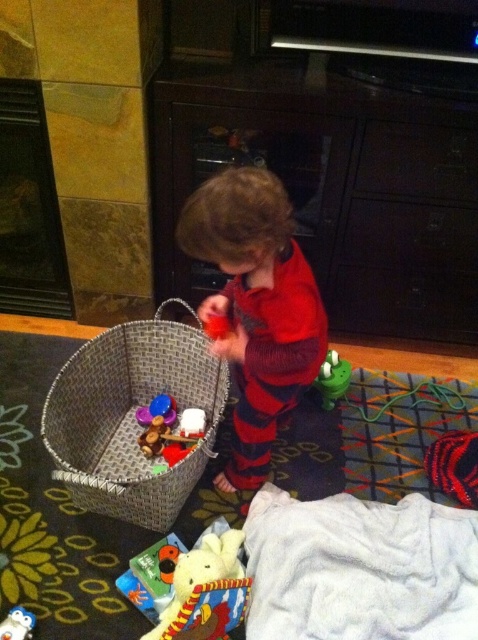
Is black matte drawer at center closer to camera compared to smooth plastic cup at center?

No.

Is point (444, 221) in front of point (142, 419)?

No, it is behind (142, 419).

Who is more forward, (x=445, y=205) or (x=148, y=406)?

Point (x=445, y=205) is in front.

Locate an element on the screen. This screenshot has height=640, width=478. black matte drawer at center is located at coordinates (411, 236).

Is woven brown basket at lower left positioned before green rubber toy at lower center?

Yes, woven brown basket at lower left is closer to the viewer.

From the picture: Does woven brown basket at lower left have a larger size compared to green rubber toy at lower center?

Yes, woven brown basket at lower left is bigger than green rubber toy at lower center.

Is point (195, 378) closer to viewer compared to point (325, 371)?

Yes, point (195, 378) is closer to viewer.

You are a GUI agent. You are given a task and a screenshot of the screen. Output one action in this format:
    pyautogui.click(x=<x>, y=<y>)
    Task: Click on the woven brown basket at lower left
    The height and width of the screenshot is (640, 478).
    Given the screenshot: What is the action you would take?
    pyautogui.click(x=130, y=417)

Is woven brown basket at lower left smaller than black matte drawer at center?

No, woven brown basket at lower left is not smaller than black matte drawer at center.

Between point (98, 440) and point (427, 218), which one is positioned in front?

Point (98, 440) is in front.

At what (x,y) coordinates should I click in order to perform the action: click on woven brown basket at lower left. Please return your answer as a coordinate pair (x, y). Image resolution: width=478 pixels, height=640 pixels. Looking at the image, I should click on (130, 417).